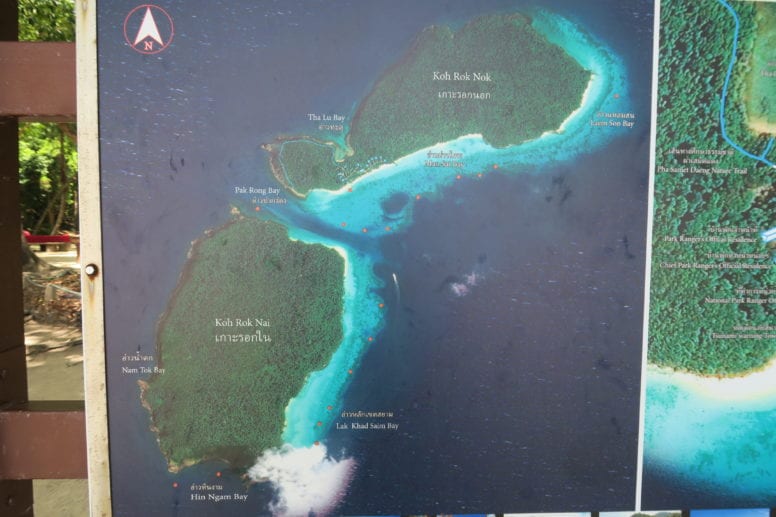
Locate an element on the screen. The width and height of the screenshot is (776, 517). island label is located at coordinates (253, 324).